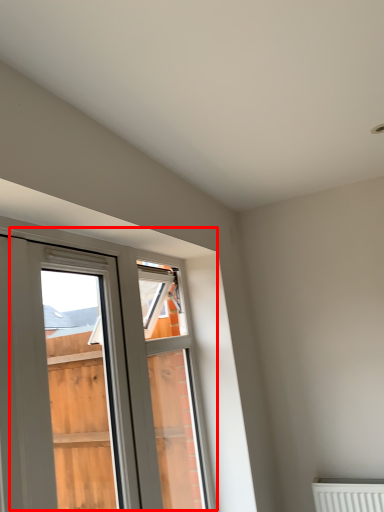
Question: From the image's perspective, considering the relative positions of window (annotated by the red box) and window frame in the image provided, where is window (annotated by the red box) located with respect to the staircase?

Choices:
 (A) below
 (B) above

Answer: (B)